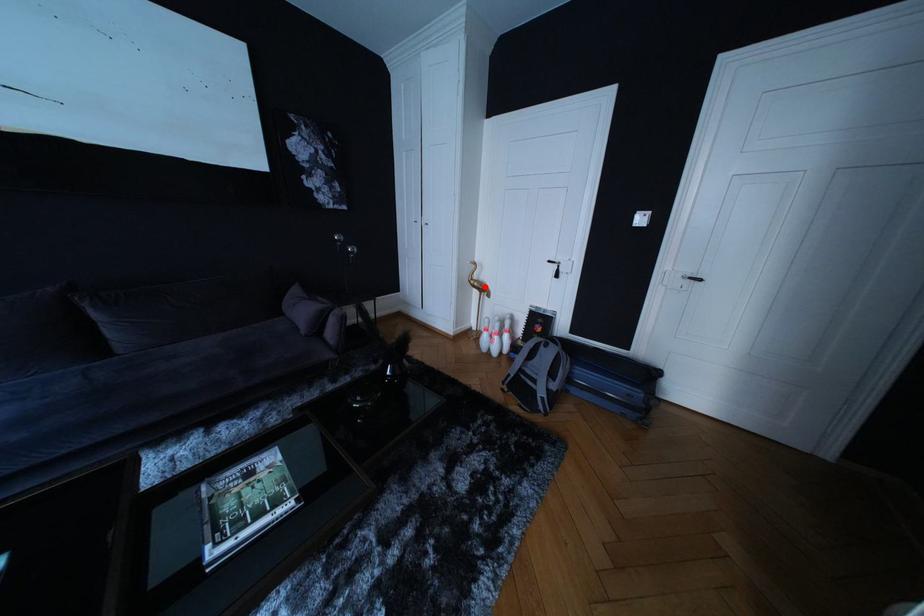
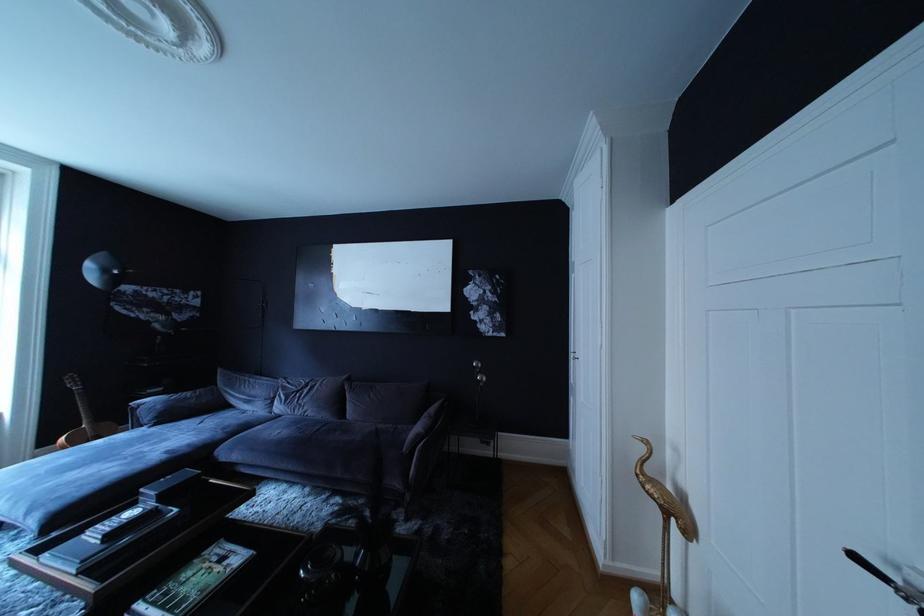
Locate, in the second image, the point that corresponds to the highlighted location in the first image.

(660, 487)